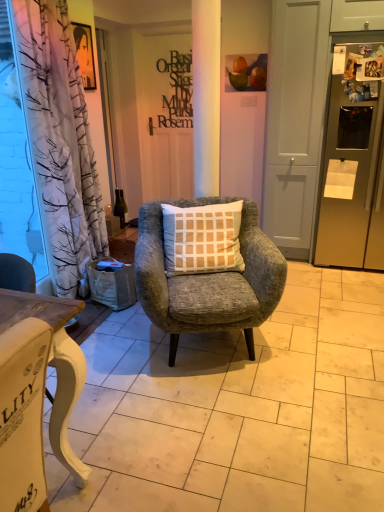
The image size is (384, 512). Find the location of `free space on the front side of satin gold refrigerator at right`. free space on the front side of satin gold refrigerator at right is located at coordinates (337, 309).